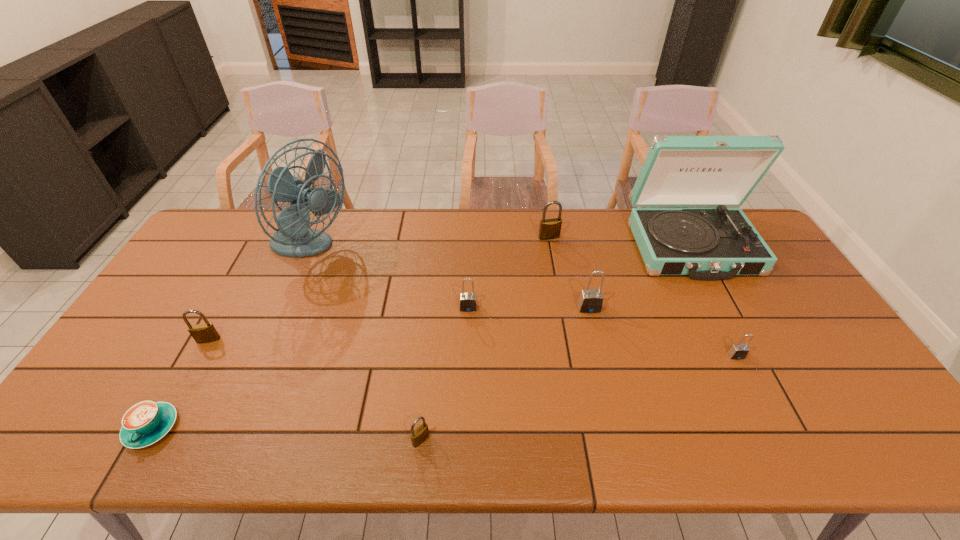
I want to click on fan, so click(294, 238).

Locate an element on the screen. Image resolution: width=960 pixels, height=540 pixels. record player is located at coordinates pyautogui.click(x=717, y=243).

Locate an element on the screen. The height and width of the screenshot is (540, 960). the farthest brass padlock is located at coordinates (549, 229).

I want to click on the rightmost brass padlock, so click(x=549, y=229).

In order to click on the second gray padlock from left to right in this screenshot , I will do `click(590, 301)`.

Where is `the biggest gray padlock`? The height and width of the screenshot is (540, 960). the biggest gray padlock is located at coordinates (590, 301).

Identify the location of the fourth padlock from right to left. (468, 301).

Find the location of a particular element. the second biggest gray padlock is located at coordinates (468, 301).

You are a GUI agent. You are given a task and a screenshot of the screen. Output one action in this format:
    pyautogui.click(x=<x>, y=<y>)
    Task: Click on the sixth farthest object
    Image resolution: width=960 pixels, height=540 pixels.
    Given the screenshot: What is the action you would take?
    pyautogui.click(x=202, y=333)

What are the coordinates of `the second biggest brass padlock` in the screenshot? It's located at (202, 333).